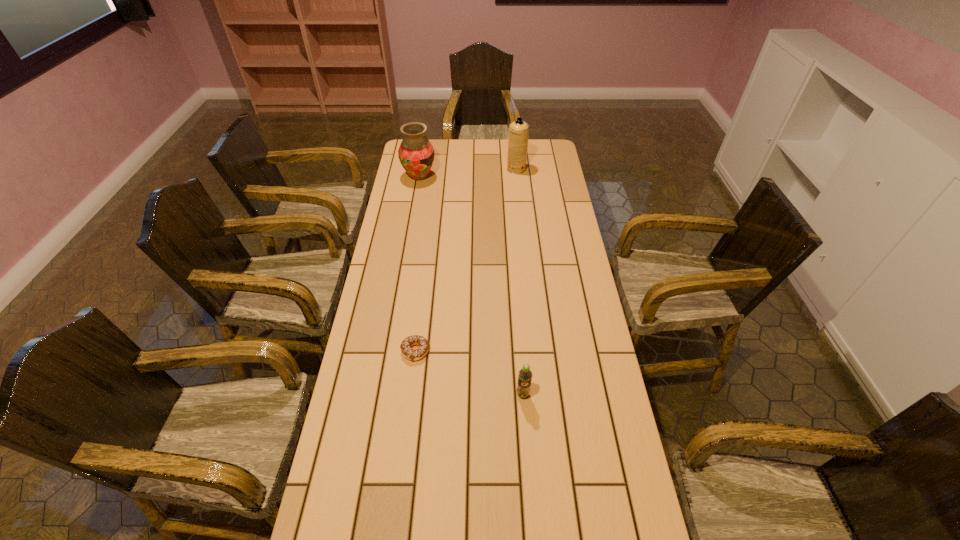
In order to click on object present at the far edge in this screenshot , I will do `click(518, 135)`.

This screenshot has width=960, height=540. In order to click on vase positioned at the left edge in this screenshot , I will do `click(416, 154)`.

You are a GUI agent. You are given a task and a screenshot of the screen. Output one action in this format:
    pyautogui.click(x=<x>, y=<y>)
    Task: Click on the doughnut at the left edge
    Image resolution: width=960 pixels, height=540 pixels.
    Given the screenshot: What is the action you would take?
    pyautogui.click(x=411, y=354)

This screenshot has width=960, height=540. I want to click on object present at the right edge, so click(518, 135).

Where is `object located in the far right corner section of the desktop`? Image resolution: width=960 pixels, height=540 pixels. object located in the far right corner section of the desktop is located at coordinates (518, 135).

You are a GUI agent. You are given a task and a screenshot of the screen. Output one action in this format:
    pyautogui.click(x=<x>, y=<y>)
    Task: Click on the free space at the far edge of the desktop
    The width and height of the screenshot is (960, 540).
    Given the screenshot: What is the action you would take?
    pyautogui.click(x=491, y=153)

Where is `free location at the left edge`? free location at the left edge is located at coordinates (404, 187).

Find the location of a particular element. Image resolution: width=960 pixels, height=540 pixels. vacant space at the right edge of the desktop is located at coordinates (540, 192).

You are a GUI agent. You are given a task and a screenshot of the screen. Output one action in this format:
    pyautogui.click(x=<x>, y=<y>)
    Task: Click on the free space at the far right corner of the desktop
    
    Given the screenshot: What is the action you would take?
    pyautogui.click(x=531, y=149)

Where is `free point between the aerosol can and the soda`? The width and height of the screenshot is (960, 540). free point between the aerosol can and the soda is located at coordinates (519, 282).